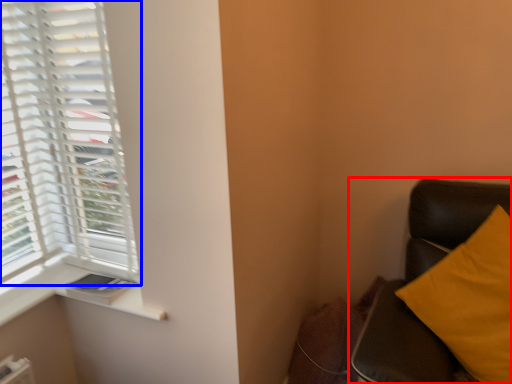
Question: Which object appears farthest to the camera in this image, furniture (highlighted by a red box) or window (highlighted by a blue box)?

Choices:
 (A) furniture
 (B) window

Answer: (B)